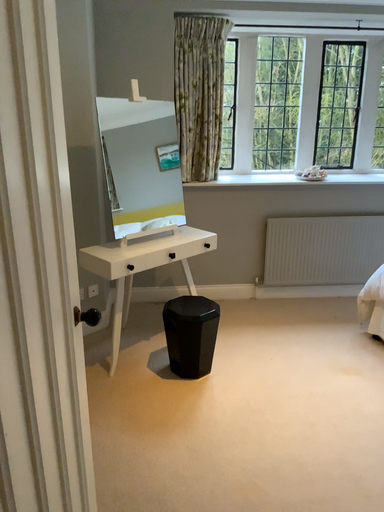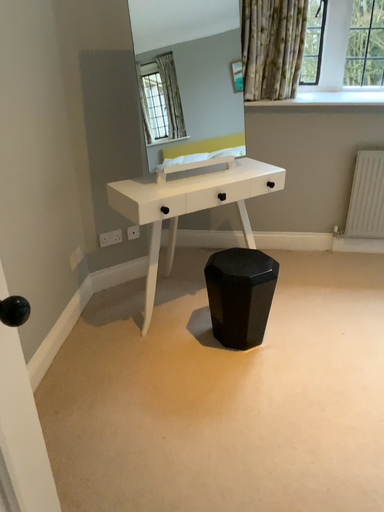
Question: How did the camera likely rotate when shooting the video?

Choices:
 (A) rotated right
 (B) rotated left

Answer: (B)